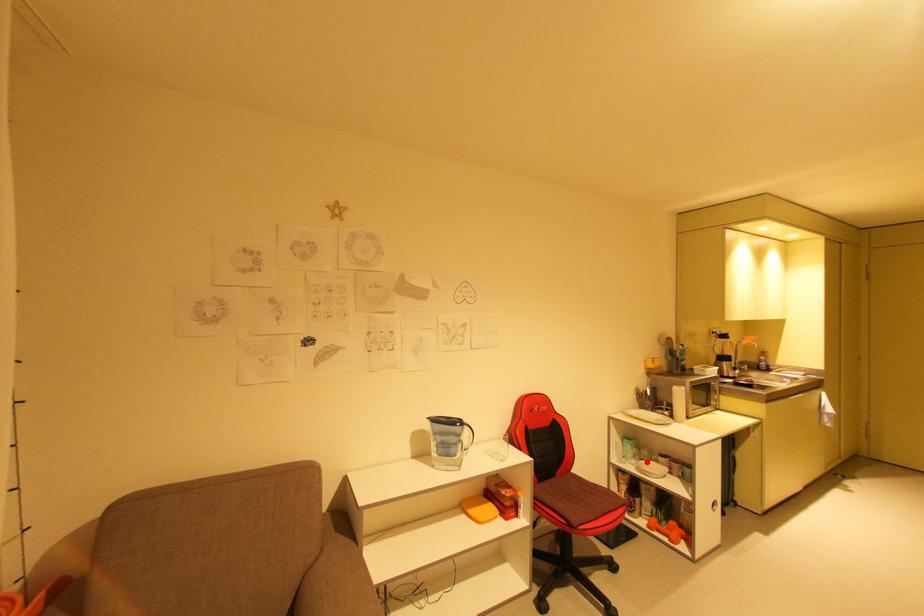
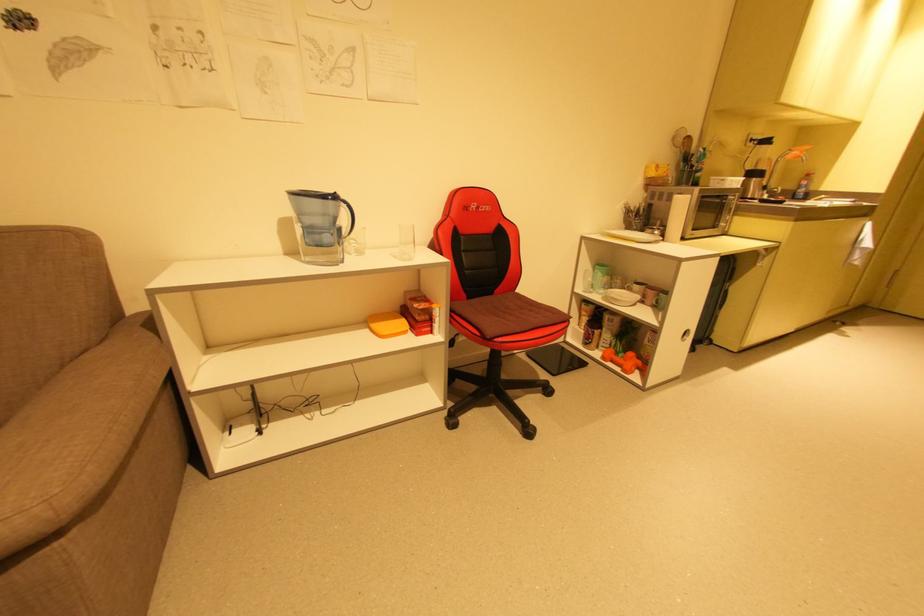
Question: A red point is marked in image1. In image2, is the corresponding 3D point closer to the camera or farther? Reply with the corresponding letter.

Choices:
 (A) The corresponding 3D point is closer.
 (B) The corresponding 3D point is farther.

Answer: (A)